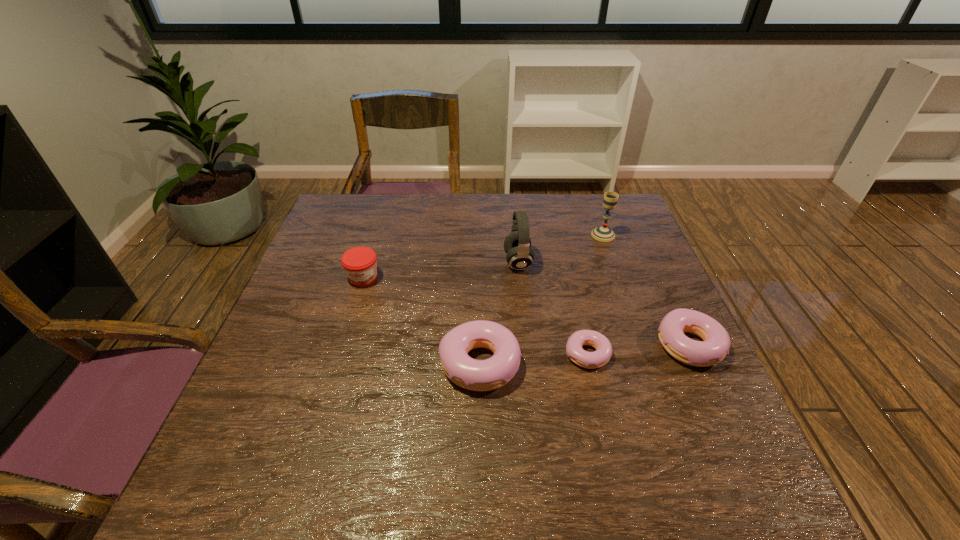
Find the location of a particular element. the leftmost doughnut is located at coordinates (478, 375).

Where is `the shortest doughnut`? the shortest doughnut is located at coordinates (591, 360).

Where is `the third object from right to left`? the third object from right to left is located at coordinates (591, 360).

Identify the location of the fifth tallest object. (715, 346).

Find the location of a particular element. the second tallest doughnut is located at coordinates (715, 346).

Image resolution: width=960 pixels, height=540 pixels. Identify the location of the leftmost object. tap(359, 263).

Where is `the farthest object`? The image size is (960, 540). the farthest object is located at coordinates (603, 233).

At what (x,y) coordinates should I click in order to perform the action: click on headset. Please return your answer as a coordinate pair (x, y). This screenshot has width=960, height=540. Looking at the image, I should click on (517, 245).

I want to click on vacant area situated on the left of the leftmost doughnut, so tap(407, 363).

Where is `vacant point located 0.130m on the left of the second doughnut from right to left`? vacant point located 0.130m on the left of the second doughnut from right to left is located at coordinates (506, 354).